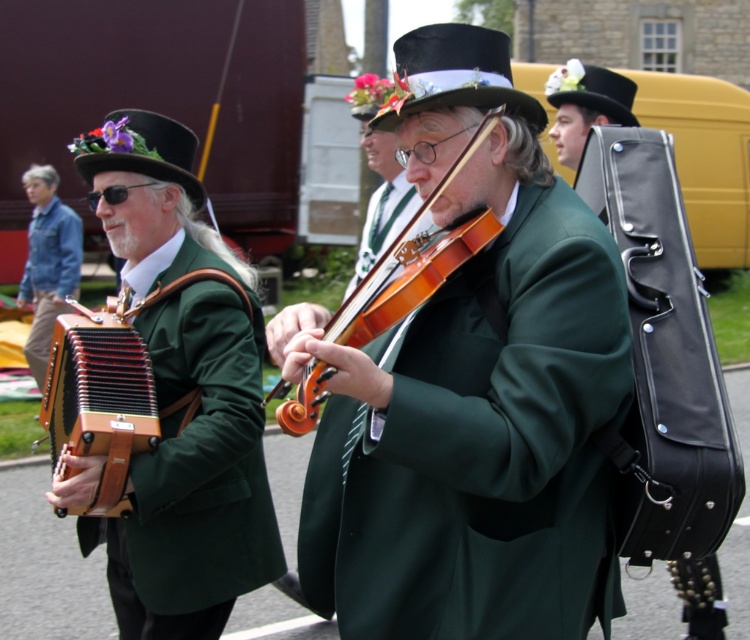
Measure the distance between wooden violin at center and camera.

wooden violin at center and camera are 2.44 meters apart.

Is point (356, 333) less distant than point (579, 97)?

Yes.

Is point (448, 177) closer to camera compared to point (567, 61)?

That is True.

Find the location of a particular element. This screenshot has height=640, width=750. wooden violin at center is located at coordinates (414, 260).

Can you confirm if matte green violin at center is positioned above black felt top hat at upper center?

Actually, matte green violin at center is below black felt top hat at upper center.

Between matte green violin at center and black felt top hat at upper center, which one appears on the left side from the viewer's perspective?

Positioned to the left is matte green violin at center.

Does point (366, 220) lie behind point (584, 83)?

Yes, it is.

At what (x,y) coordinates should I click in order to perform the action: click on matte green violin at center. Please return your answer as a coordinate pair (x, y). The height and width of the screenshot is (640, 750). Looking at the image, I should click on (382, 202).

In the scene shown: Between wooden violin at center and denim jacket at left, which one appears on the right side from the viewer's perspective?

From the viewer's perspective, wooden violin at center appears more on the right side.

Is point (375, 307) closer to viewer compared to point (33, 372)?

Yes.

Does point (399, 252) come behind point (36, 264)?

No, it is in front of (36, 264).

The width and height of the screenshot is (750, 640). In order to click on wooden violin at center in this screenshot , I will do `click(414, 260)`.